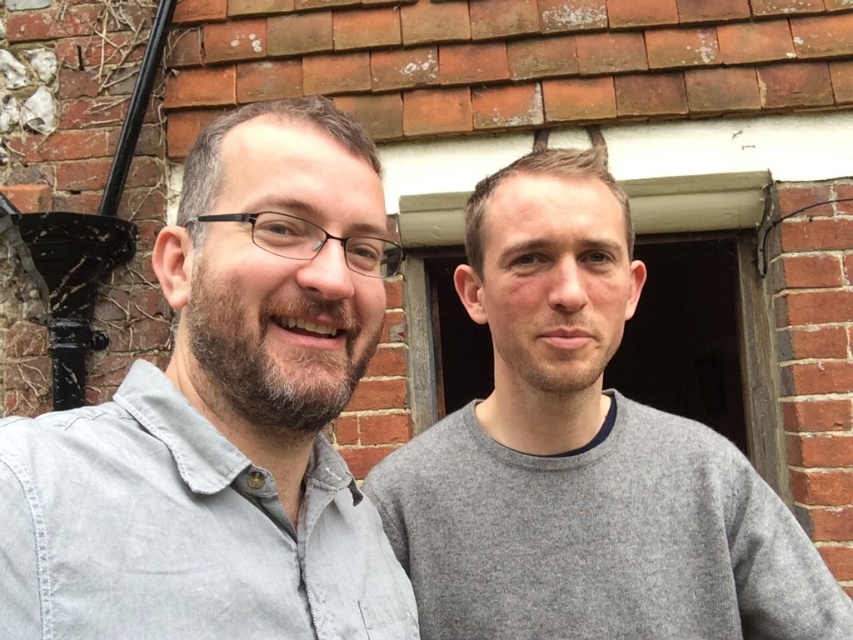
You are standing in front of the brick building and want to locate the gray cotton shirt at left. According to the coordinates provided, where should you look?

The gray cotton shirt at left is located at point coordinates (224, 417).

You are standing in front of a brick building and see a point marked at coordinates (224, 417). Based on the scene description, which object does this point correspond to?

The point at coordinates (224, 417) corresponds to the gray cotton shirt at left.

You are taking a photo of two people wearing gray cotton shirt at left and gray wool sweater at right. Which person is standing to the left of the other?

The gray cotton shirt at left is positioned on the left side of gray wool sweater at right, so the person wearing the gray cotton shirt at left is standing to the left of the person in the gray wool sweater at right.